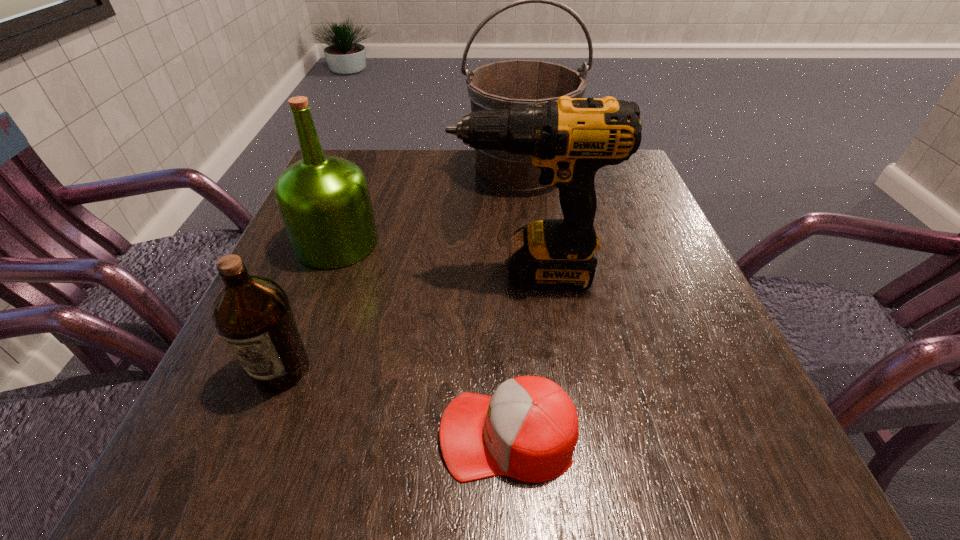
Image resolution: width=960 pixels, height=540 pixels. I want to click on vacant space situated 0.210m on the right of the farther olive oil, so click(x=483, y=243).

The height and width of the screenshot is (540, 960). Find the location of `blank area located on the label of the nearer olive oil`. blank area located on the label of the nearer olive oil is located at coordinates (255, 437).

Locate an element on the screen. The height and width of the screenshot is (540, 960). free space located 0.140m on the front-facing side of the shortest object is located at coordinates (334, 435).

This screenshot has width=960, height=540. I want to click on vacant space located on the front-facing side of the shortest object, so click(x=236, y=435).

Locate an element on the screen. vacant space located 0.310m on the front-facing side of the shortest object is located at coordinates (206, 435).

Find the location of `object situated at the far edge`. object situated at the far edge is located at coordinates (496, 86).

Identify the location of object present at the near edge. Image resolution: width=960 pixels, height=540 pixels. (528, 430).

Locate an element on the screen. bucket that is at the right edge is located at coordinates (496, 86).

Image resolution: width=960 pixels, height=540 pixels. Identify the location of drill present at the right edge. (569, 139).

Where is `object at the far right corner`? object at the far right corner is located at coordinates (496, 86).